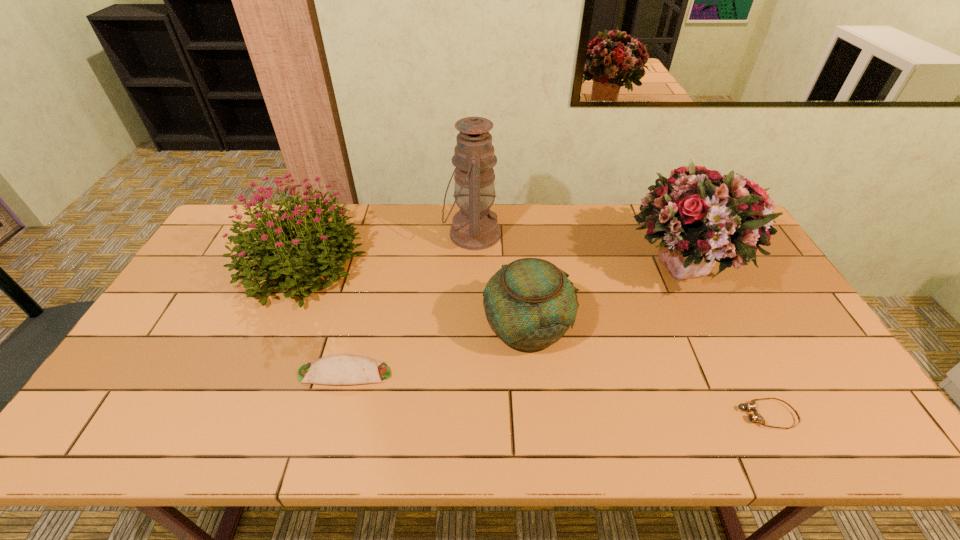
The image size is (960, 540). In order to click on object located in the far left corner section of the desktop in this screenshot , I will do `click(269, 240)`.

Find the location of a particular element. This screenshot has height=540, width=960. object positioned at the far right corner is located at coordinates pos(702,216).

Where is `object present at the near right corner`? object present at the near right corner is located at coordinates (751, 406).

Find the location of `vacant space at the far edge`. vacant space at the far edge is located at coordinates tap(622, 234).

What are the coordinates of `blank space at the near edge of the desktop` in the screenshot? It's located at (473, 441).

In the image, there is a desktop. Identify the location of vacant space at the left edge. point(204,323).

Image resolution: width=960 pixels, height=540 pixels. In order to click on vacant region at the right edge of the desktop in this screenshot , I will do point(799,362).

You are a GUI agent. You are given a task and a screenshot of the screen. Output one action in this format:
    pyautogui.click(x=<x>, y=<y>)
    Task: Click on the vacant space at the far left corner of the desktop
    The image size is (960, 540).
    Given the screenshot: What is the action you would take?
    pyautogui.click(x=274, y=204)

Where is `blank space at the near left corner of the desktop`? blank space at the near left corner of the desktop is located at coordinates (114, 426).

Find the location of a particular element. Image resolution: width=960 pixels, height=540 pixels. vacant area that lies between the right bouquet and the left bouquet is located at coordinates (492, 268).